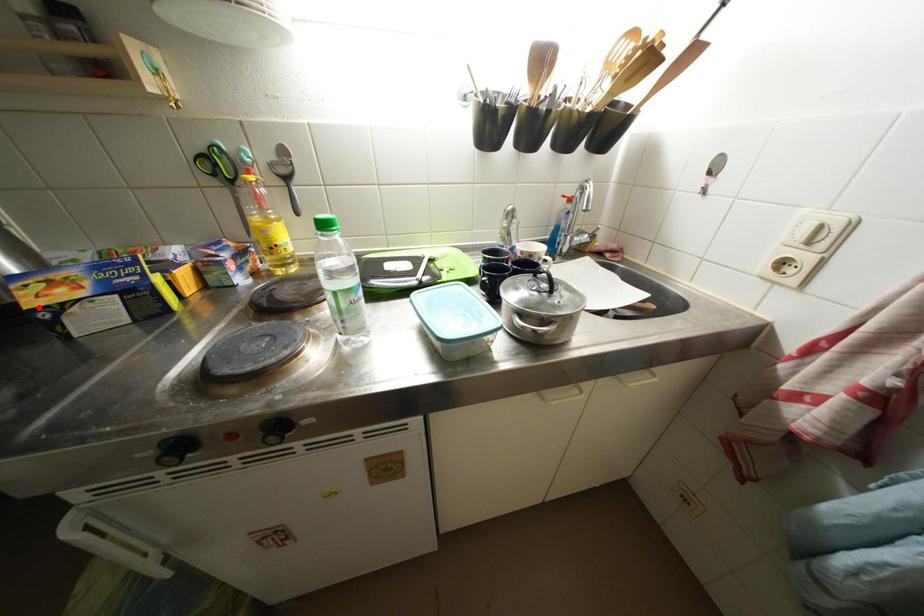
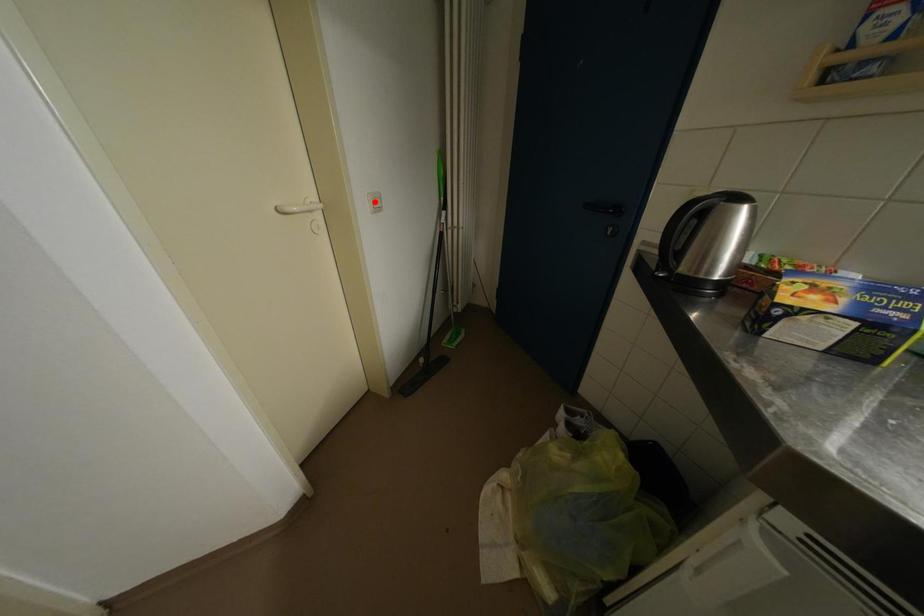
I am providing you with two images of the same scene from different viewpoints. A red point is marked on the first image and another point is marked on the second image. Do the highlighted points in image1 and image2 indicate the same real-world spot?

No